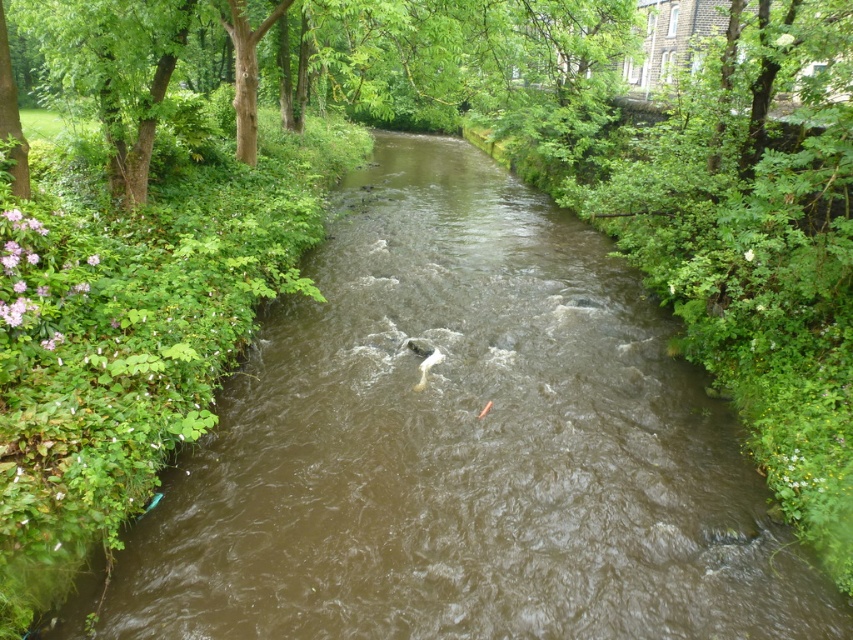
Question: Among these points, which one is nearest to the camera?

Choices:
 (A) (426, 372)
 (B) (285, 17)

Answer: (A)

Question: Is green leafy tree at upper center bigger than white matte fish at center?

Choices:
 (A) yes
 (B) no

Answer: (A)

Question: Observing the image, what is the correct spatial positioning of green leafy tree at upper center in reference to white matte fish at center?

Choices:
 (A) left
 (B) right

Answer: (A)

Question: Is green leafy tree at upper center behind white matte fish at center?

Choices:
 (A) no
 (B) yes

Answer: (A)

Question: Among these points, which one is nearest to the camera?

Choices:
 (A) (428, 356)
 (B) (241, 36)

Answer: (A)

Question: Among these points, which one is nearest to the camera?

Choices:
 (A) (434, 358)
 (B) (74, 29)

Answer: (A)